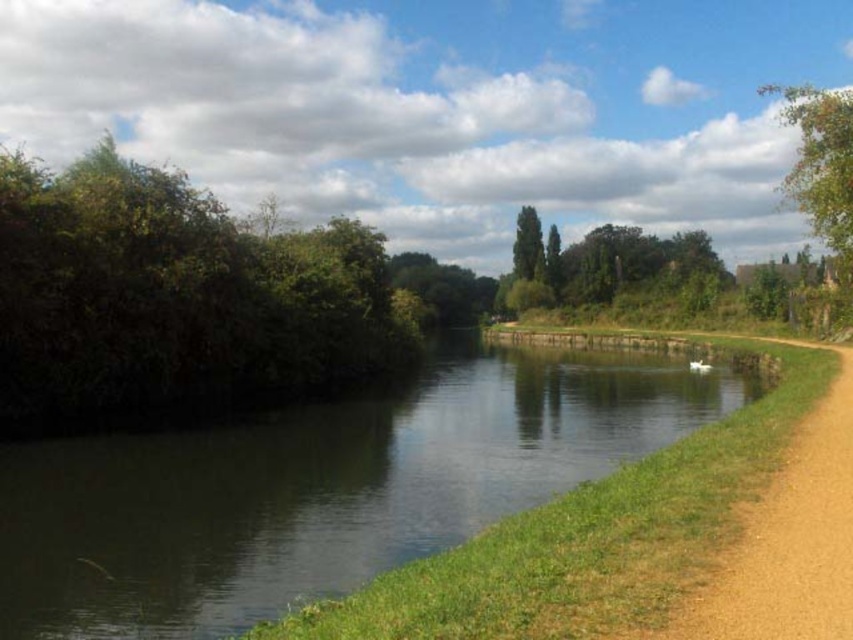
You are standing at the edge of the river and want to walk towards the green leafy tree at upper right. Which direction should you turn to avoid the green leafy tree at center?

You should turn to the right to avoid the green leafy tree at center, as the green leafy tree at upper right is located to the right of it.

You are a bird looking for a nesting spot. You see the green leafy tree at upper right and the green leafy tree at center. Which tree has a wider canopy for nesting?

The green leafy tree at upper right has a wider canopy than the green leafy tree at center, so it is better for nesting.